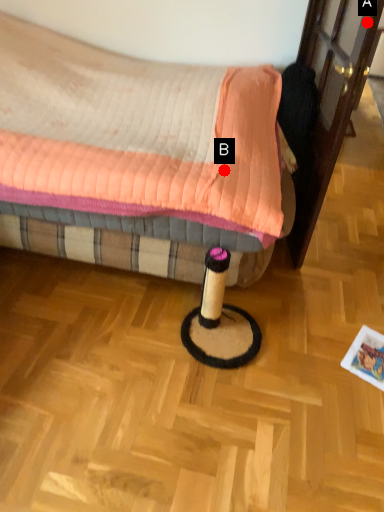
Question: Two points are circled on the image, labeled by A and B beside each circle. Which point is farther from the camera taking this photo?

Choices:
 (A) A is further
 (B) B is further

Answer: (B)